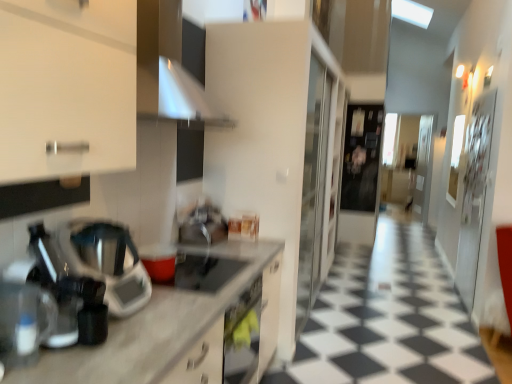
Locate an element on the screen. This screenshot has width=512, height=384. vacant area on top of matte black gas stove at center (from a real-world perspective) is located at coordinates (204, 268).